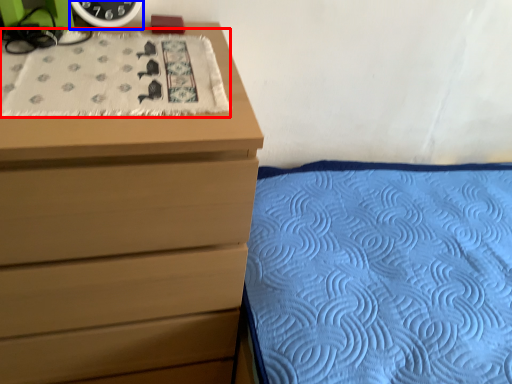
Question: Which object is further to the camera taking this photo, blanket (highlighted by a red box) or clock (highlighted by a blue box)?

Choices:
 (A) blanket
 (B) clock

Answer: (B)